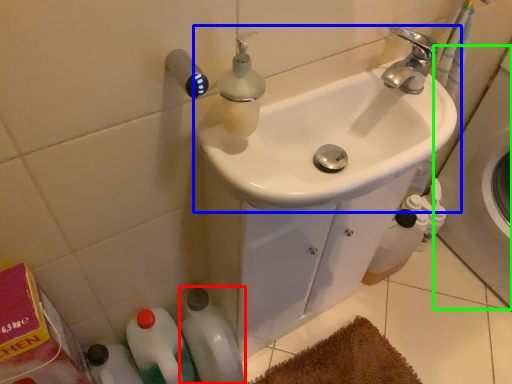
Question: Which object is positioned farthest from bottle (highlighted by a red box)? Select from sink (highlighted by a blue box) and bath (highlighted by a green box).

Choices:
 (A) sink
 (B) bath

Answer: (B)